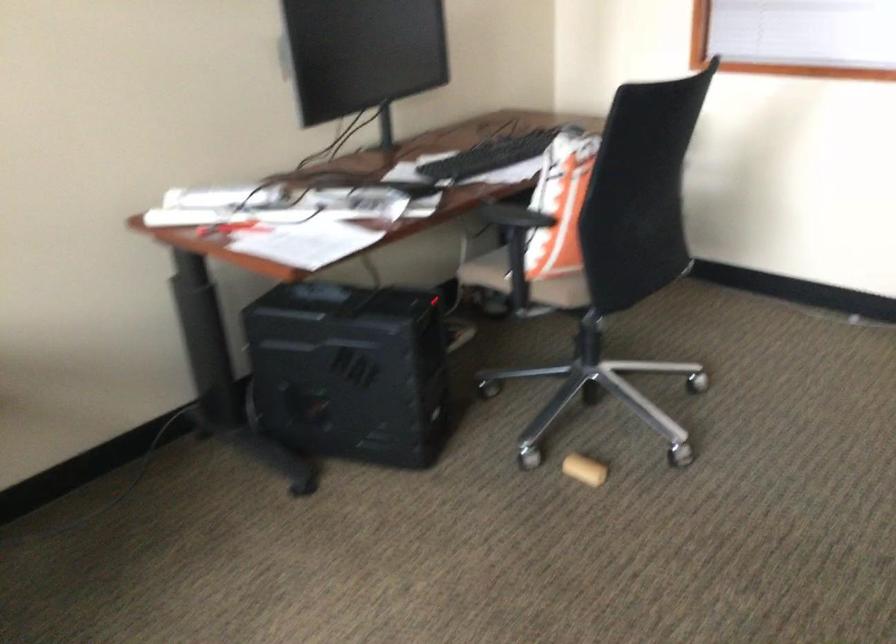
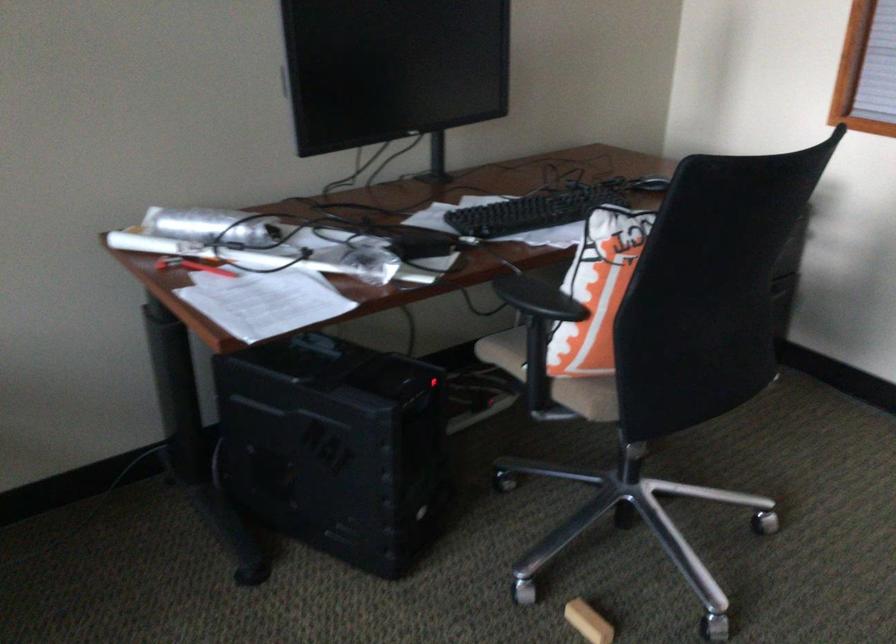
Find the pixel in the second image that matches the point at 520,214 in the first image.

(538, 299)